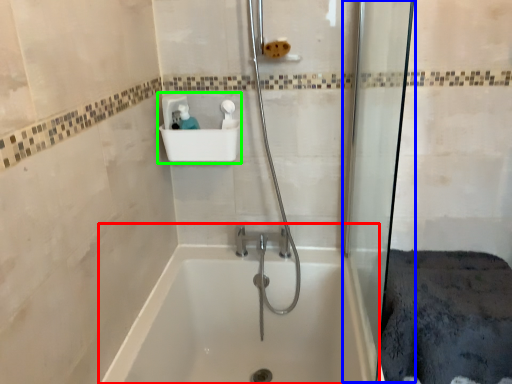
Question: Which object is the farthest from bathtub (highlighted by a red box)? Choose among these: shower door (highlighted by a blue box) or sink (highlighted by a green box).

Choices:
 (A) shower door
 (B) sink

Answer: (B)